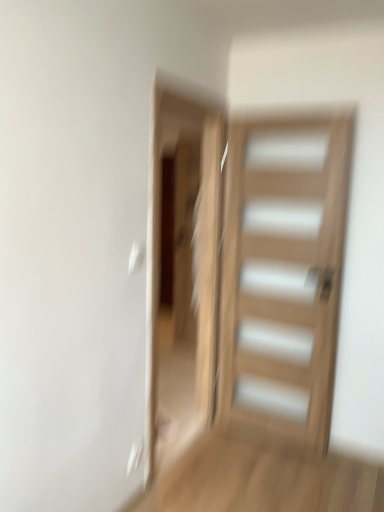
Question: Considering their positions, is transparent glass screen door at center located in front of or behind natural wood door at center?

Choices:
 (A) behind
 (B) front

Answer: (B)

Question: Based on their positions, is transparent glass screen door at center located to the left or right of natural wood door at center?

Choices:
 (A) right
 (B) left

Answer: (B)

Question: Choose the correct answer: Is transparent glass screen door at center inside natural wood door at center or outside it?

Choices:
 (A) inside
 (B) outside

Answer: (B)

Question: From a real-world perspective, is natural wood door at center physically located above or below transparent glass screen door at center?

Choices:
 (A) below
 (B) above

Answer: (A)

Question: Is natural wood door at center taller or shorter than transparent glass screen door at center?

Choices:
 (A) tall
 (B) short

Answer: (B)

Question: Is natural wood door at center bigger or smaller than transparent glass screen door at center?

Choices:
 (A) small
 (B) big

Answer: (A)

Question: Is natural wood door at center inside or outside of transparent glass screen door at center?

Choices:
 (A) inside
 (B) outside

Answer: (B)